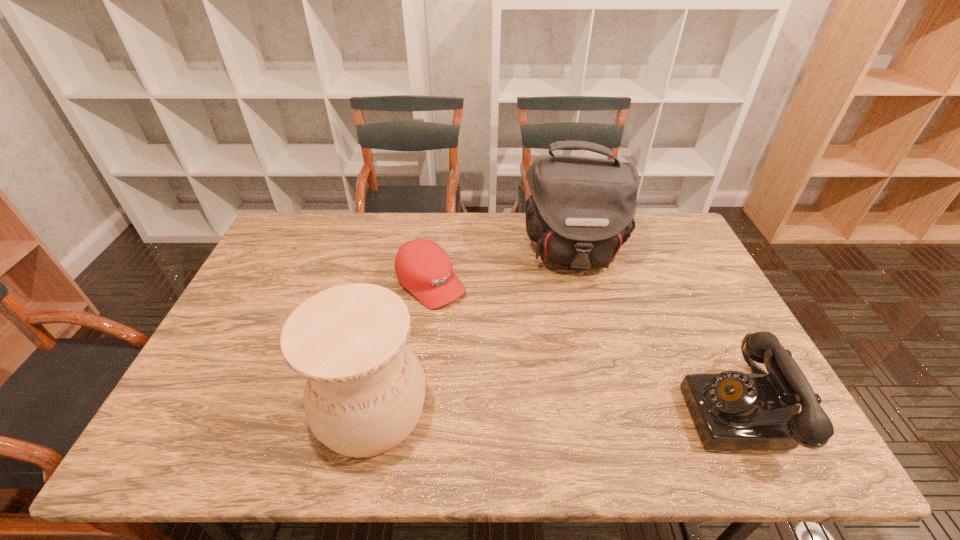
Image resolution: width=960 pixels, height=540 pixels. I want to click on the second tallest object, so click(x=365, y=388).

Where is `the second shortest object`? The image size is (960, 540). the second shortest object is located at coordinates pos(733,410).

Image resolution: width=960 pixels, height=540 pixels. I want to click on telephone, so click(x=733, y=410).

I want to click on the shortest object, so click(x=422, y=267).

Identify the location of the second object from right to left. This screenshot has width=960, height=540. (581, 210).

Find the location of a particular element. This screenshot has height=540, width=960. shoulder bag is located at coordinates (581, 210).

At what (x,y) coordinates should I click in order to perform the action: click on blank space located at the open side of the third shortest object. Please return your answer as a coordinate pair (x, y). This screenshot has height=540, width=960. Looking at the image, I should click on (228, 408).

Where is `vacant space located at the open side of the third shortest object`? The width and height of the screenshot is (960, 540). vacant space located at the open side of the third shortest object is located at coordinates [257, 408].

Locate an element on the screen. blank space located 0.090m at the open side of the third shortest object is located at coordinates (278, 408).

This screenshot has width=960, height=540. I want to click on vacant area located 0.190m on the dial of the telephone, so click(606, 411).